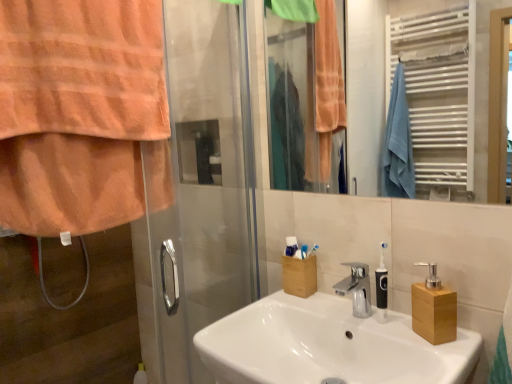
Question: Does wooden block soap dispenser at right, the second soap dispenser from the left, have a greater width compared to metallic silver towel rack at upper right?

Choices:
 (A) no
 (B) yes

Answer: (B)

Question: From a real-world perspective, is wooden block soap dispenser at right, the 1th soap dispenser when ordered from right to left, physically below metallic silver towel rack at upper right?

Choices:
 (A) no
 (B) yes

Answer: (B)

Question: Is metallic silver towel rack at upper right located within wooden block soap dispenser at right, the 1th soap dispenser when ordered from right to left?

Choices:
 (A) yes
 (B) no

Answer: (B)

Question: Is wooden block soap dispenser at right, the 1th soap dispenser when ordered from right to left, aimed at metallic silver towel rack at upper right?

Choices:
 (A) no
 (B) yes

Answer: (A)

Question: From the image's perspective, would you say wooden block soap dispenser at right, the second soap dispenser from the left, is shown under metallic silver towel rack at upper right?

Choices:
 (A) no
 (B) yes

Answer: (B)

Question: Considering the positions of white ceramic sink at center and wooden block at right, placed as the first soap dispenser when sorted from left to right, in the image, is white ceramic sink at center wider or thinner than wooden block at right, placed as the first soap dispenser when sorted from left to right,?

Choices:
 (A) wide
 (B) thin

Answer: (A)

Question: Is white ceramic sink at center in front of or behind wooden block at right, placed as the 2th soap dispenser when sorted from right to left, in the image?

Choices:
 (A) front
 (B) behind

Answer: (A)

Question: Considering the positions of point (316, 314) and point (376, 278), is point (316, 314) closer or farther from the camera than point (376, 278)?

Choices:
 (A) closer
 (B) farther

Answer: (B)

Question: From a real-world perspective, is white ceramic sink at center positioned above or below wooden block at right, placed as the 2th soap dispenser when sorted from right to left?

Choices:
 (A) above
 (B) below

Answer: (B)

Question: Is metallic silver towel rack at upper right inside the boundaries of wooden block soap dispenser at right, the second soap dispenser from the left, or outside?

Choices:
 (A) inside
 (B) outside

Answer: (B)

Question: Visually, is metallic silver towel rack at upper right positioned to the left or to the right of wooden block soap dispenser at right, the second soap dispenser from the left?

Choices:
 (A) left
 (B) right

Answer: (A)

Question: Looking at the image, does metallic silver towel rack at upper right seem bigger or smaller compared to wooden block soap dispenser at right, the second soap dispenser from the left?

Choices:
 (A) big
 (B) small

Answer: (A)

Question: From a real-world perspective, is metallic silver towel rack at upper right physically located above or below wooden block soap dispenser at right, the 1th soap dispenser when ordered from right to left?

Choices:
 (A) above
 (B) below

Answer: (A)

Question: From a real-world perspective, is orange towel at left positioned above or below wooden block soap dispenser at right, the 1th soap dispenser when ordered from right to left?

Choices:
 (A) below
 (B) above

Answer: (B)

Question: Is orange towel at left inside the boundaries of wooden block soap dispenser at right, the 1th soap dispenser when ordered from right to left, or outside?

Choices:
 (A) outside
 (B) inside

Answer: (A)